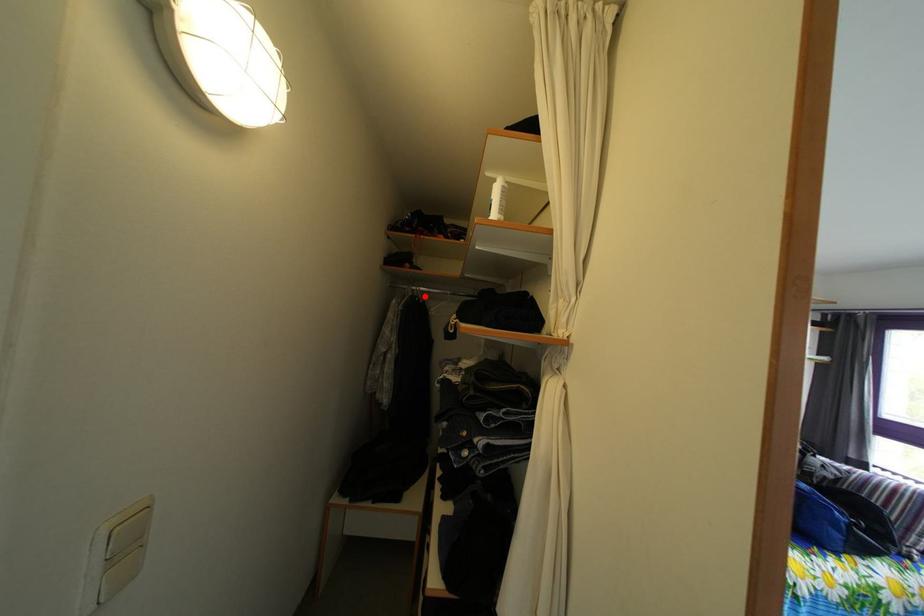
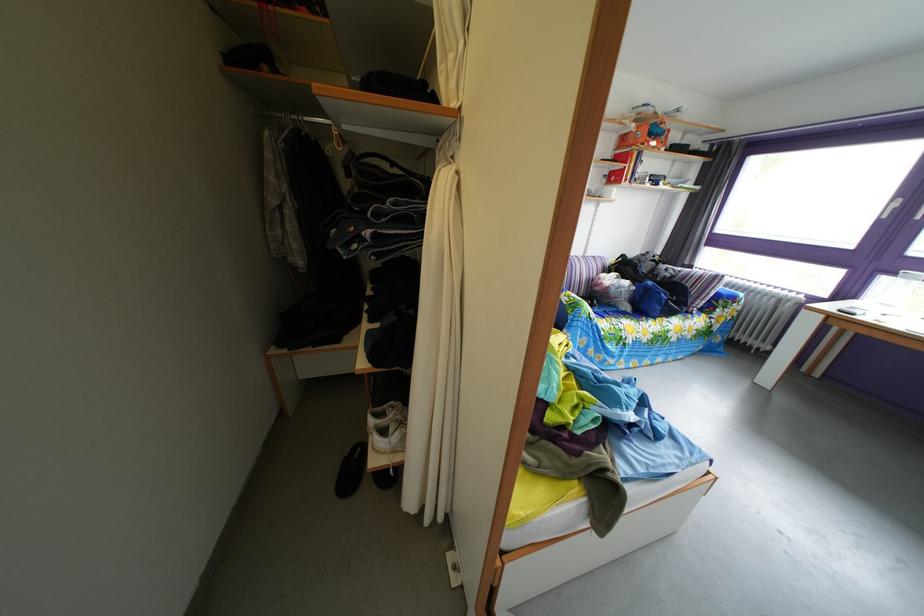
Locate, in the second image, the point that corresponds to the highlighted location in the first image.

(306, 126)